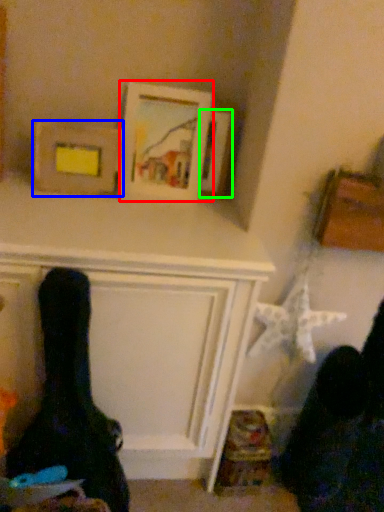
Question: Considering the real-world distances, which object is closest to picture frame (highlighted by a red box)? picture frame (highlighted by a blue box) or picture frame (highlighted by a green box).

Choices:
 (A) picture frame
 (B) picture frame

Answer: (B)